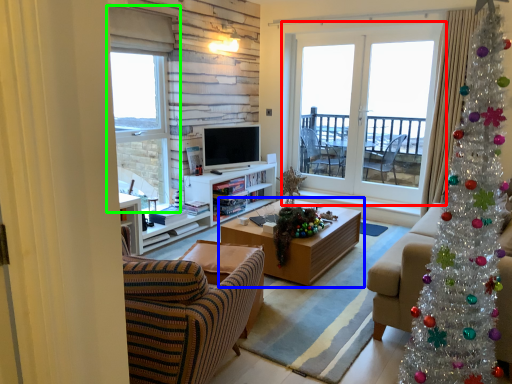
Question: Estimate the real-world distances between objects in this image. Which object is farther from window (highlighted by a red box), coffee table (highlighted by a blue box) or window (highlighted by a green box)?

Choices:
 (A) coffee table
 (B) window

Answer: (B)